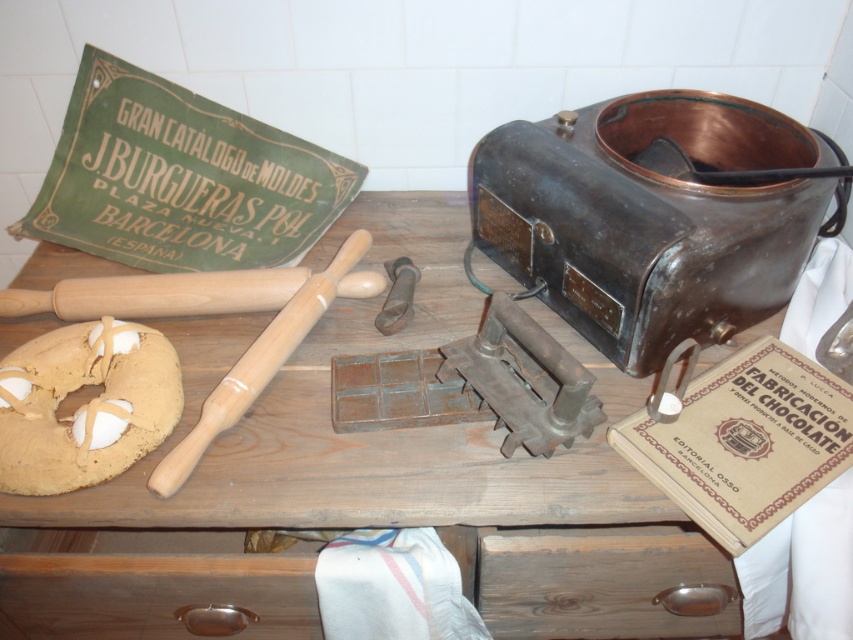
Who is more forward, (564, 611) or (593, 637)?

Point (564, 611) is in front.

Consider the image. Which of these two, wooden table at center or dark brown wood drawer at lower center, stands taller?

Standing taller between the two is wooden table at center.

I want to click on wooden table at center, so click(357, 490).

Can you confirm if dark brown wood drawer at lower center is smaller than golden brown doughnut at center-left?

No, dark brown wood drawer at lower center is not smaller than golden brown doughnut at center-left.

Can you confirm if dark brown wood drawer at lower center is taller than golden brown doughnut at center-left?

Yes, dark brown wood drawer at lower center is taller than golden brown doughnut at center-left.

Between point (668, 609) and point (175, 412), which one is positioned behind?

Point (668, 609)

Image resolution: width=853 pixels, height=640 pixels. What are the coordinates of `dark brown wood drawer at lower center` in the screenshot? It's located at (604, 582).

Can you confirm if wooden table at center is smaller than golden brown doughnut at center-left?

Incorrect, wooden table at center is not smaller in size than golden brown doughnut at center-left.

Who is shorter, wooden table at center or golden brown doughnut at center-left?

With less height is golden brown doughnut at center-left.

Is point (553, 477) positioned in front of point (96, 397)?

No, (553, 477) is further to viewer.

What are the coordinates of `wooden table at center` in the screenshot? It's located at (357, 490).